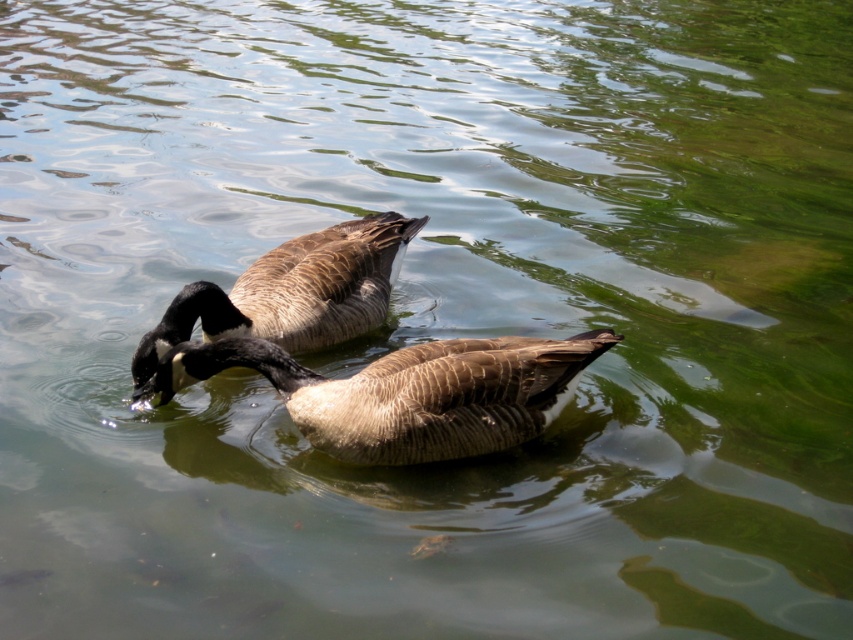
Find the location of a particular element. The height and width of the screenshot is (640, 853). brown textured duck at center is located at coordinates (405, 392).

Who is more forward, (463, 380) or (247, 273)?

Point (463, 380) is more forward.

The image size is (853, 640). What do you see at coordinates (405, 392) in the screenshot? I see `brown textured duck at center` at bounding box center [405, 392].

You are a GUI agent. You are given a task and a screenshot of the screen. Output one action in this format:
    pyautogui.click(x=<x>, y=<y>)
    Task: Click on the brown textured duck at center
    This screenshot has width=853, height=640.
    Given the screenshot: What is the action you would take?
    pyautogui.click(x=405, y=392)